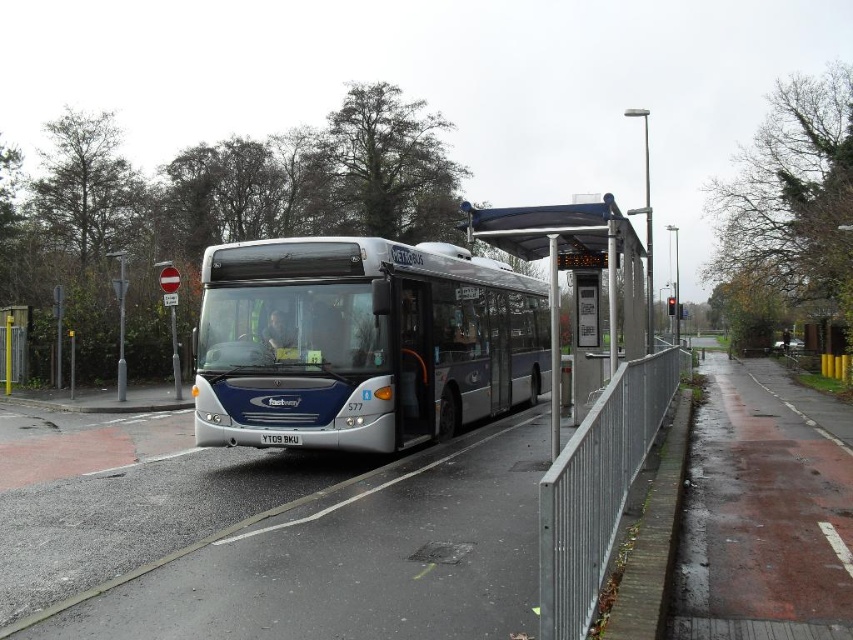
Question: Among these points, which one is farthest from the camera?

Choices:
 (A) (608, 360)
 (B) (401, 321)
 (C) (614, 444)

Answer: (B)

Question: Where is silver metallic bus at center located in relation to transparent plastic bus stop at center in the image?

Choices:
 (A) below
 (B) above

Answer: (A)

Question: Which object is closer to the camera taking this photo?

Choices:
 (A) silver metallic bus at center
 (B) transparent plastic bus stop at center

Answer: (B)

Question: Among these objects, which one is farthest from the camera?

Choices:
 (A) transparent plastic bus stop at center
 (B) silver metallic fence at right

Answer: (A)

Question: Where is silver metallic fence at right located in relation to transparent plastic bus stop at center in the image?

Choices:
 (A) below
 (B) above

Answer: (A)

Question: Does silver metallic fence at right appear over transparent plastic bus stop at center?

Choices:
 (A) no
 (B) yes

Answer: (A)